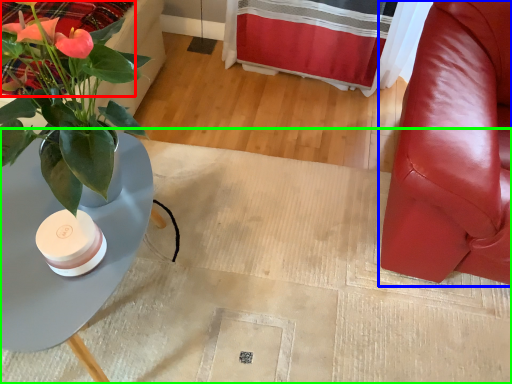
Question: Which object is positioned closest to bedding (highlighted by a red box)? Select from chair (highlighted by a blue box) and plain (highlighted by a green box).

Choices:
 (A) chair
 (B) plain

Answer: (B)